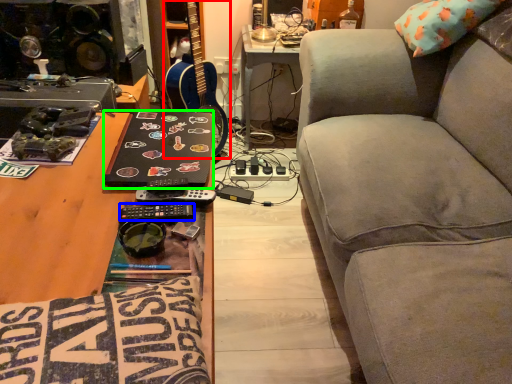
Question: Considering the real-world distances, which object is closest to guitar (highlighted by a red box)? remote (highlighted by a blue box) or laptop (highlighted by a green box).

Choices:
 (A) remote
 (B) laptop

Answer: (B)